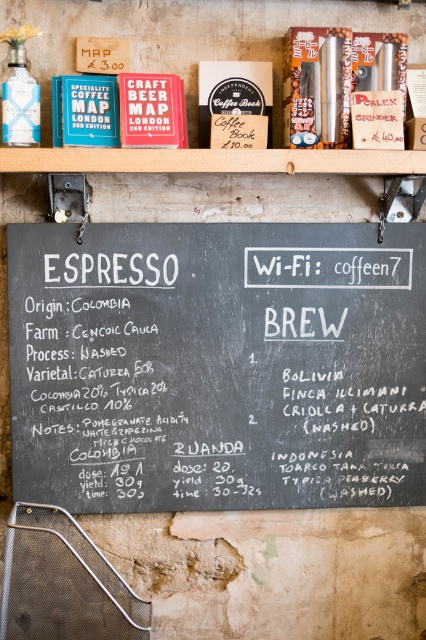
You are a customer standing at the entrance of the rustic cafe and want to read the menu details on the black chalkboard at center. Can you comfortably read the menu from your current position?

The black chalkboard at center is 2.07 meters away from camera, so yes, you can comfortably read the menu from your current position as the distance is within a typical comfortable reading range.

You are a customer entering the rustic cafe and notice the black chalkboard at center and the wooden at upper center. According to their positions, which object is closer to the entrance?

The wooden at upper center is closer to the entrance because the black chalkboard at center is positioned to its right, implying the wooden object is nearer to the entrance area.

You are a customer entering the rustic cafe and notice the black chalkboard at center and the wooden at upper center. Which object is wider?

The wooden at upper center is wider than the black chalkboard at center.